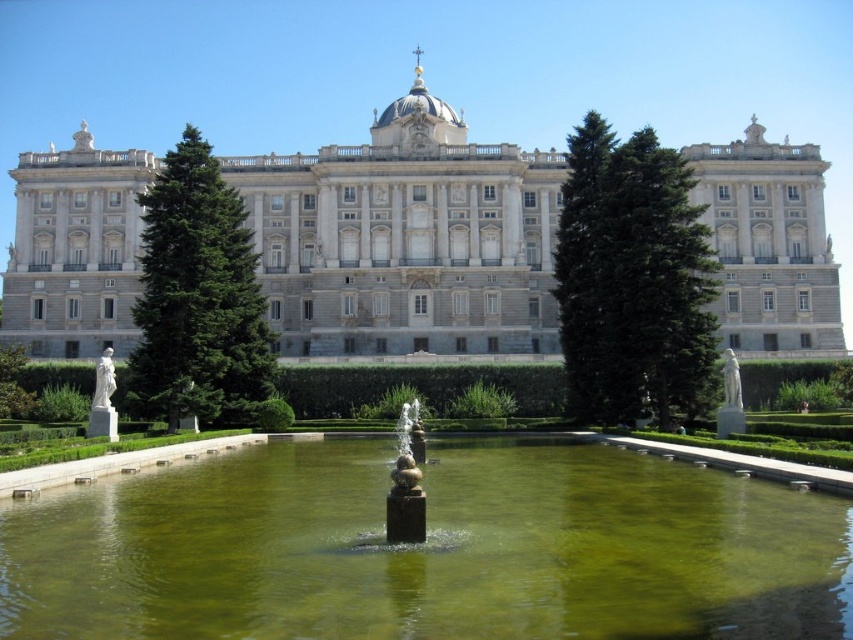
Question: Does white stone palace at center have a smaller size compared to green textured tree at center?

Choices:
 (A) yes
 (B) no

Answer: (B)

Question: Which object is positioned farthest from the white stone palace at center?

Choices:
 (A) white marble statue at left
 (B) green glossy tree at center
 (C) green water at center
 (D) green textured tree at center

Answer: (A)

Question: Which object appears farthest from the camera in this image?

Choices:
 (A) green textured tree at center
 (B) white marble statue at left
 (C) green water at center

Answer: (A)

Question: Is green water at center to the right of white marble statue at left from the viewer's perspective?

Choices:
 (A) yes
 (B) no

Answer: (A)

Question: Which point is closer to the camera?

Choices:
 (A) (352, 300)
 (B) (560, 292)
 (C) (213, 401)
 (D) (109, 394)

Answer: (D)

Question: Does green textured tree at center have a smaller size compared to white marble statue at left?

Choices:
 (A) no
 (B) yes

Answer: (A)